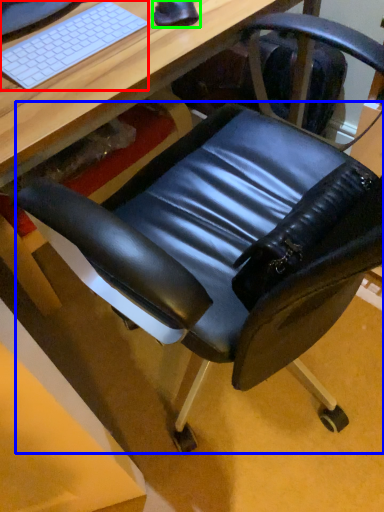
Question: Considering the real-world distances, which object is farthest from computer keyboard (highlighted by a red box)? swivel chair (highlighted by a blue box) or mouse (highlighted by a green box)?

Choices:
 (A) swivel chair
 (B) mouse

Answer: (A)